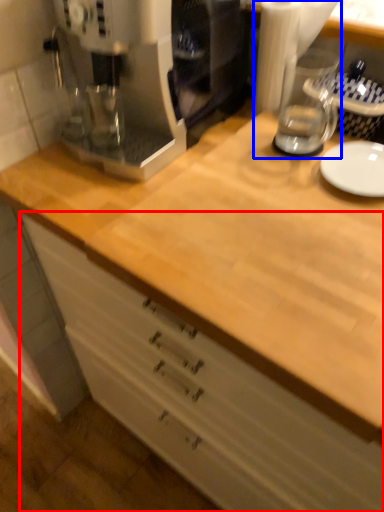
Question: Among these objects, which one is nearest to the camera, cabinetry (highlighted by a red box) or blender (highlighted by a blue box)?

Choices:
 (A) cabinetry
 (B) blender

Answer: (A)